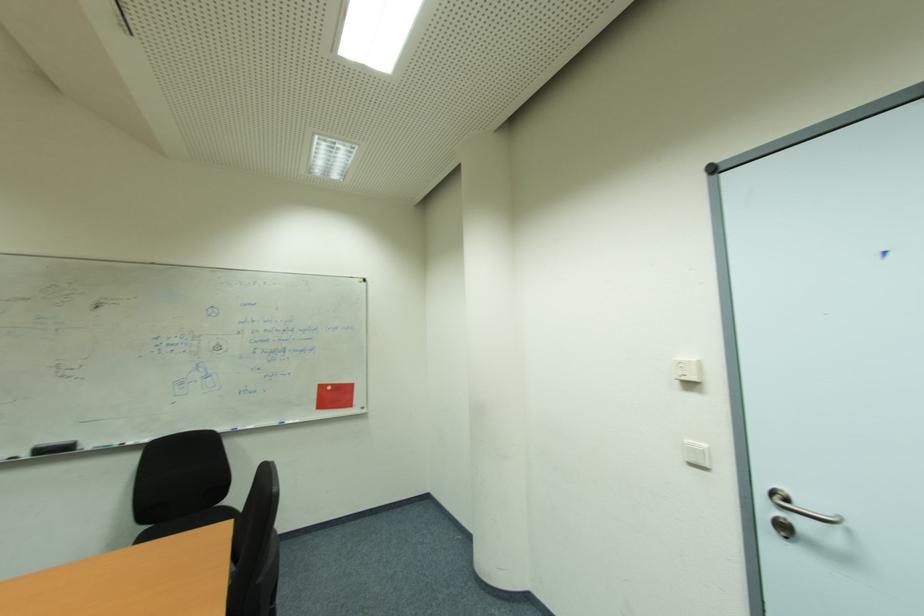
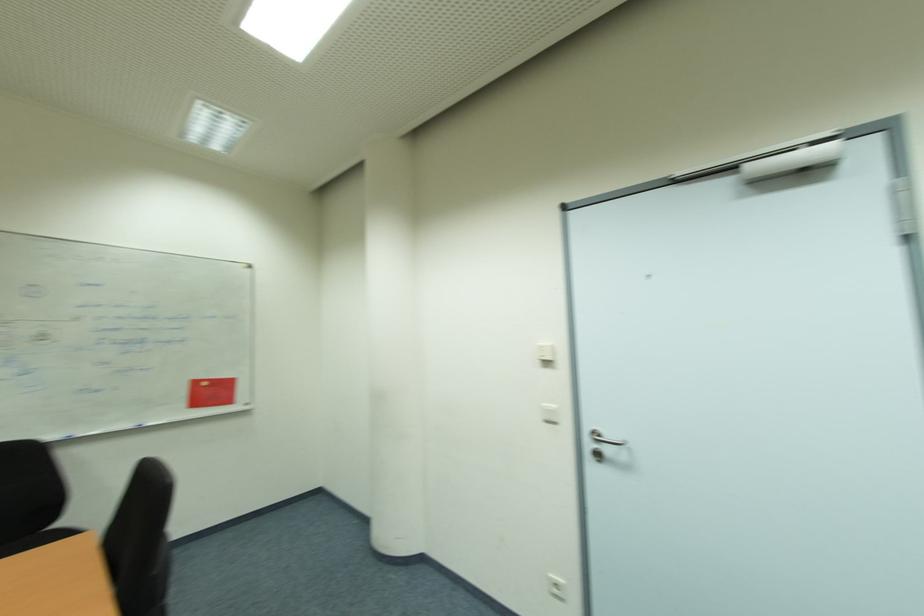
Question: The camera is either moving clockwise (left) or counter-clockwise (right) around the object. The first image is from the beginning of the video and the second image is from the end. Is the camera moving left or right when shooting the video?

Choices:
 (A) Left
 (B) Right

Answer: (A)